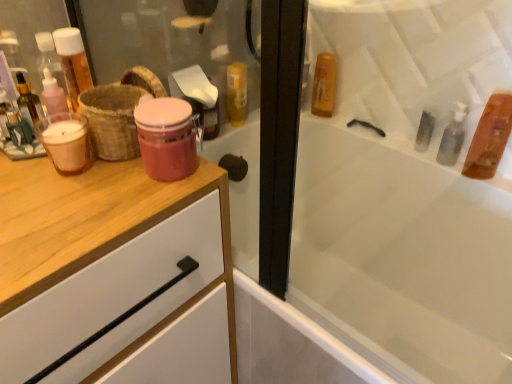
Question: From the image's perspective, is translucent glass mouthwash at left, which ranks as the 4th mouthwash in right-to-left order, below translucent amber liquid at upper right, the 2th mouthwash viewed from the right?

Choices:
 (A) no
 (B) yes

Answer: (B)

Question: From a real-world perspective, is translucent glass mouthwash at left, the first mouthwash positioned from the left, positioned under translucent amber liquid at upper right, placed as the first mouthwash when sorted from back to front, based on gravity?

Choices:
 (A) yes
 (B) no

Answer: (B)

Question: Is translucent glass mouthwash at left, the first mouthwash positioned from the left, at the left side of translucent amber liquid at upper right, placed as the first mouthwash when sorted from back to front?

Choices:
 (A) no
 (B) yes

Answer: (B)

Question: Is translucent glass mouthwash at left, the 2th mouthwash when ordered from front to back, directly adjacent to translucent amber liquid at upper right, marked as the fourth mouthwash in a front-to-back arrangement?

Choices:
 (A) yes
 (B) no

Answer: (B)

Question: Is translucent amber liquid at upper right, marked as the 3th mouthwash in a left-to-right arrangement, a part of translucent glass mouthwash at left, the third mouthwash when ordered from back to front?

Choices:
 (A) no
 (B) yes

Answer: (A)

Question: Is translucent glass mouthwash at left, which ranks as the 4th mouthwash in right-to-left order, positioned behind translucent amber liquid at upper right, the 2th mouthwash viewed from the right?

Choices:
 (A) no
 (B) yes

Answer: (A)

Question: Is white glossy bathtub at upper right outside of brown woven basket at left?

Choices:
 (A) no
 (B) yes

Answer: (B)

Question: From a real-world perspective, is white glossy bathtub at upper right located higher than brown woven basket at left?

Choices:
 (A) yes
 (B) no

Answer: (B)

Question: Is white glossy bathtub at upper right bigger than brown woven basket at left?

Choices:
 (A) yes
 (B) no

Answer: (A)

Question: Considering the relative sizes of white glossy bathtub at upper right and brown woven basket at left in the image provided, is white glossy bathtub at upper right wider than brown woven basket at left?

Choices:
 (A) no
 (B) yes

Answer: (B)

Question: From the image's perspective, does white glossy bathtub at upper right appear lower than brown woven basket at left?

Choices:
 (A) no
 (B) yes

Answer: (B)

Question: Is white glossy bathtub at upper right closer to the viewer compared to brown woven basket at left?

Choices:
 (A) no
 (B) yes

Answer: (B)

Question: Considering the relative sizes of translucent glass mouthwash at left, the first mouthwash positioned from the left, and brown woven basket at left in the image provided, is translucent glass mouthwash at left, the first mouthwash positioned from the left, thinner than brown woven basket at left?

Choices:
 (A) yes
 (B) no

Answer: (A)